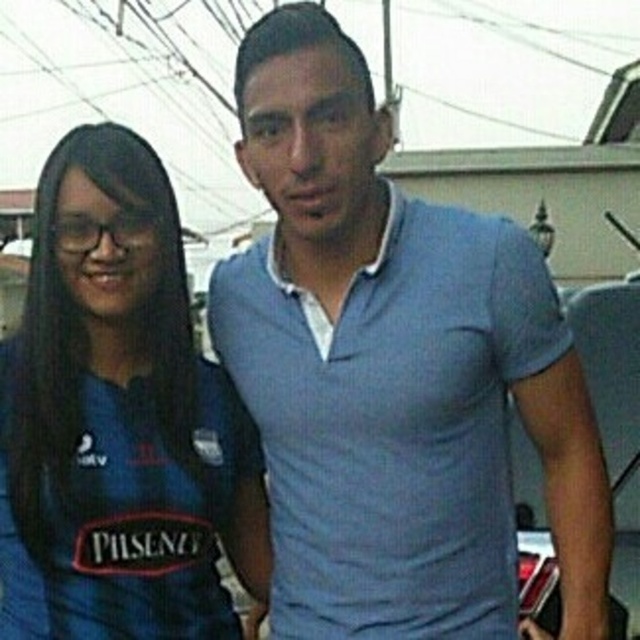
Does matte blue polo shirt at center come behind blue fabric shirt at left?

That is False.

Which is behind, point (362, 252) or point (61, 259)?

The point (362, 252) is behind.

Does point (529, 273) come closer to viewer compared to point (157, 544)?

Yes, it is in front of point (157, 544).

Identify the location of matte blue polo shirt at center. (394, 371).